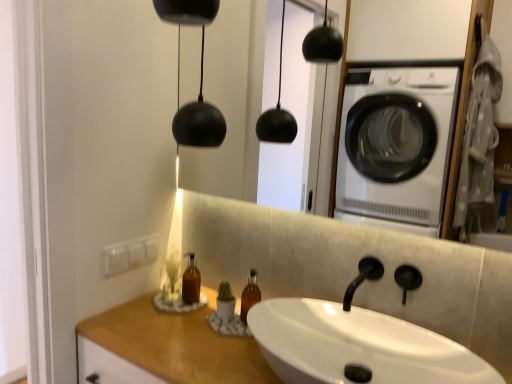
What is the approximate width of translucent amber bottle at center?

2.75 inches.

This screenshot has height=384, width=512. I want to click on white glossy sink at center, so click(x=357, y=345).

Is white glossy sink at center situated inside black matte faucet at center or outside?

white glossy sink at center is outside black matte faucet at center.

Considering the sizes of objects white glossy sink at center and black matte faucet at center in the image provided, who is wider, white glossy sink at center or black matte faucet at center?

white glossy sink at center is wider.

Considering the sizes of white glossy sink at center and black matte faucet at center in the image, is white glossy sink at center bigger or smaller than black matte faucet at center?

white glossy sink at center is bigger than black matte faucet at center.

Which is in front, point (478, 372) or point (349, 310)?

The point (478, 372) is closer to the camera.

Is wooden counter top at lower left to the right of white glossy sink at center from the viewer's perspective?

Incorrect, wooden counter top at lower left is not on the right side of white glossy sink at center.

Is wooden counter top at lower left aimed at white glossy sink at center?

No, wooden counter top at lower left is not facing towards white glossy sink at center.

Considering the points (97, 327) and (406, 335), which point is in front, point (97, 327) or point (406, 335)?

The point (406, 335) is closer.

From a real-world perspective, who is located higher, wooden counter top at lower left or white glossy sink at center?

white glossy sink at center is physically above.

Based on the photo, can you confirm if black matte faucet at center is shorter than translucent amber bottle at center?

Yes.

Considering the relative positions of black matte faucet at center and translucent amber bottle at center in the image provided, is black matte faucet at center to the left or to the right of translucent amber bottle at center?

In the image, black matte faucet at center appears on the right side of translucent amber bottle at center.

The width and height of the screenshot is (512, 384). Identify the location of bottle below the black matte faucet at center (from the image's perspective). (191, 281).

From the image's perspective, is wooden counter top at lower left beneath black matte faucet at center?

Yes, from the image's perspective, wooden counter top at lower left is below black matte faucet at center.

What are the coordinates of `faucet above the wooden counter top at lower left (from the image's perspective)` in the screenshot? It's located at pyautogui.click(x=362, y=278).

Can you confirm if wooden counter top at lower left is wider than black matte faucet at center?

Yes.

Does point (193, 262) lie in front of point (106, 345)?

No.

Where is `bottle to the left of wooden counter top at lower left`? This screenshot has height=384, width=512. bottle to the left of wooden counter top at lower left is located at coordinates click(191, 281).

Looking at their sizes, would you say translucent amber bottle at center is wider or thinner than wooden counter top at lower left?

translucent amber bottle at center is thinner than wooden counter top at lower left.

From the image's perspective, which is above, translucent amber bottle at center or wooden counter top at lower left?

translucent amber bottle at center appears higher in the image.

Does wooden counter top at lower left touch translucent amber bottle at center?

wooden counter top at lower left and translucent amber bottle at center are not in contact.

Is wooden counter top at lower left oriented towards translucent amber bottle at center?

No, wooden counter top at lower left does not turn towards translucent amber bottle at center.

Which of these two, translucent amber bottle at center or white glossy sink at center, is thinner?

translucent amber bottle at center.

Is translucent amber bottle at center next to white glossy sink at center?

translucent amber bottle at center and white glossy sink at center are clearly separated.

Is translucent amber bottle at center positioned beyond the bounds of white glossy sink at center?

Yes.

Is translucent amber bottle at center in front of or behind white glossy sink at center in the image?

translucent amber bottle at center is behind white glossy sink at center.

Locate an element on the screen. The width and height of the screenshot is (512, 384). sink on the left of black matte faucet at center is located at coordinates (357, 345).

The height and width of the screenshot is (384, 512). What are the coordinates of `sink on the right of wooden counter top at lower left` in the screenshot? It's located at (357, 345).

Considering their positions, is translucent amber bottle at center positioned closer to wooden counter top at lower left than white glossy sink at center?

The object closer to wooden counter top at lower left is translucent amber bottle at center.

From the picture: Which object lies nearer to the anchor point wooden counter top at lower left, translucent amber bottle at center or black matte faucet at center?

translucent amber bottle at center.

Looking at this image, looking at the image, which one is located closer to black matte faucet at center, white glossy sink at center or translucent amber bottle at center?

white glossy sink at center lies closer to black matte faucet at center than the other object.

Which object lies further to the anchor point white glossy sink at center, wooden counter top at lower left or black matte faucet at center?

wooden counter top at lower left is positioned further to the anchor white glossy sink at center.

Which object lies further to the anchor point black matte faucet at center, wooden counter top at lower left or white glossy sink at center?

wooden counter top at lower left lies further to black matte faucet at center than the other object.

Estimate the real-world distances between objects in this image. Which object is further from white glossy sink at center, wooden counter top at lower left or translucent amber bottle at center?

translucent amber bottle at center is positioned further to the anchor white glossy sink at center.

Looking at the image, which one is located further to black matte faucet at center, wooden counter top at lower left or translucent amber bottle at center?

translucent amber bottle at center is further to black matte faucet at center.

When comparing their distances from translucent amber bottle at center, does white glossy sink at center or black matte faucet at center seem further?

black matte faucet at center lies further to translucent amber bottle at center than the other object.

Where is `sink that lies between black matte faucet at center and wooden counter top at lower left from top to bottom`? Image resolution: width=512 pixels, height=384 pixels. sink that lies between black matte faucet at center and wooden counter top at lower left from top to bottom is located at coordinates (357, 345).

Where is `faucet between white glossy sink at center and translucent amber bottle at center from front to back`? The image size is (512, 384). faucet between white glossy sink at center and translucent amber bottle at center from front to back is located at coordinates click(x=362, y=278).

The height and width of the screenshot is (384, 512). I want to click on counter top between white glossy sink at center and translucent amber bottle at center from front to back, so click(x=172, y=346).

Locate an element on the screen. faucet between wooden counter top at lower left and translucent amber bottle at center from front to back is located at coordinates (362, 278).